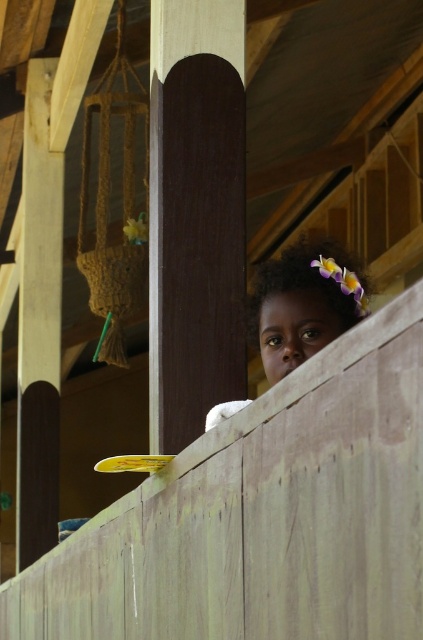
Does dark wood pole at center have a lesser width compared to dark brown hair at upper center?

Yes.

Is point (200, 307) positioned behind point (272, 376)?

Yes.

Image resolution: width=423 pixels, height=640 pixels. Describe the element at coordinates (195, 214) in the screenshot. I see `dark wood pole at center` at that location.

Where is `dark wood pole at center`? dark wood pole at center is located at coordinates (195, 214).